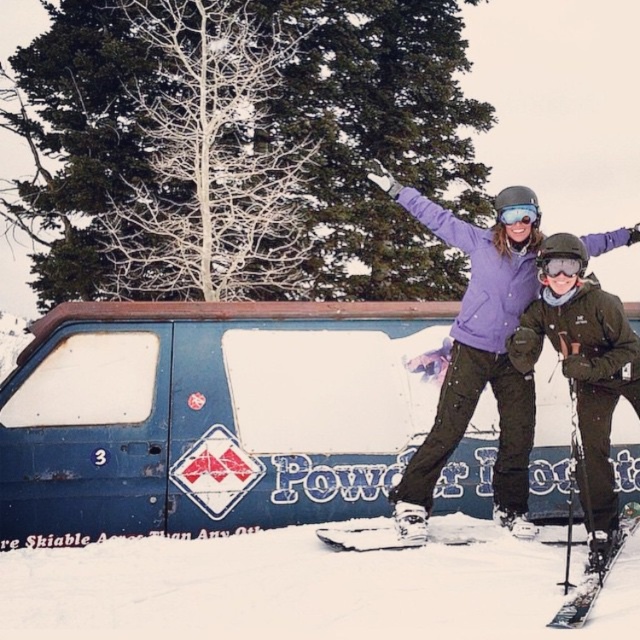
In the scene shown: You are planning to place a toy car that is the same size as the transparent plastic goggles at center onto the blue matte van at center. Will the toy car fit entirely on the van?

The blue matte van at center is wider than the transparent plastic goggles at center, so the toy car will fit entirely on the van.